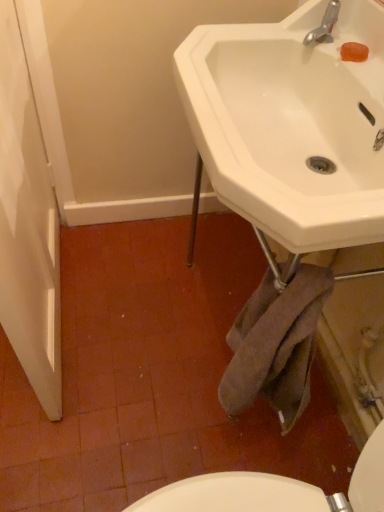
What do you see at coordinates (291, 124) in the screenshot? This screenshot has height=512, width=384. I see `white glossy sink at center` at bounding box center [291, 124].

This screenshot has height=512, width=384. Identify the location of white glossy sink at center. (291, 124).

Identify the location of white glossy sink at center. (291, 124).